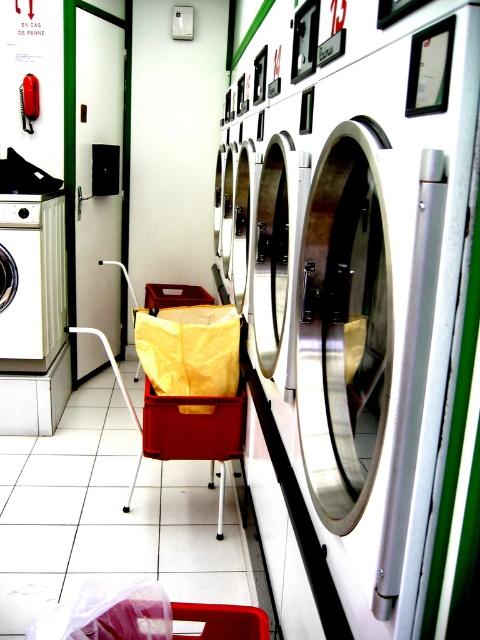
Question: Observing the image, what is the correct spatial positioning of white glossy washing machine at center in reference to matte red plastic crate at center?

Choices:
 (A) left
 (B) right

Answer: (B)

Question: Among these points, which one is farthest from the camera?

Choices:
 (A) (144, 433)
 (B) (380, 586)
 (C) (218, 445)

Answer: (A)

Question: Which object is positioned farthest from the matte red plastic crate at center?

Choices:
 (A) matte red cart at center
 (B) white glossy washing machine at center

Answer: (B)

Question: Does white glossy washing machine at center come behind matte red cart at center?

Choices:
 (A) yes
 (B) no

Answer: (B)

Question: Does white glossy washing machine at center appear over matte red cart at center?

Choices:
 (A) no
 (B) yes

Answer: (B)

Question: Which is farther from the matte red cart at center?

Choices:
 (A) white glossy washing machine at center
 (B) matte red plastic crate at center

Answer: (A)